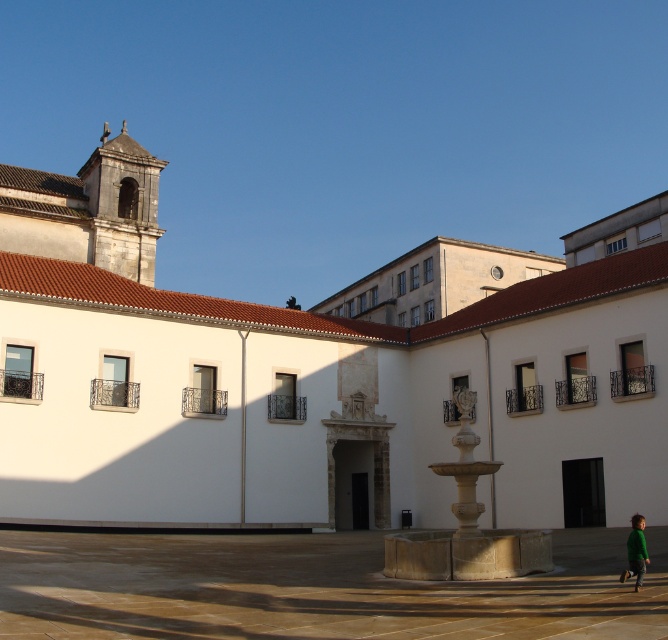
Can you confirm if white stone church at center is shorter than smooth stone fountain at center?

No.

In the scene shown: Who is more forward, (440, 422) or (582, 563)?

Positioned in front is point (582, 563).

Find the location of a particular element. white stone church at center is located at coordinates (319, 374).

Is point (236, 605) more distant than point (639, 548)?

That is False.

Which of these two, smooth stone fountain at center or green matte shirt at lower right, stands shorter?

Standing shorter between the two is green matte shirt at lower right.

Measure the distance between point (208, 636) and camera.

They are 19.39 meters apart.

Locate an element on the screen. smooth stone fountain at center is located at coordinates (311, 588).

Which is in front, point (108, 364) or point (639, 580)?

Positioned in front is point (639, 580).

The height and width of the screenshot is (640, 668). Describe the element at coordinates (319, 374) in the screenshot. I see `white stone church at center` at that location.

Locate an element on the screen. white stone church at center is located at coordinates (319, 374).